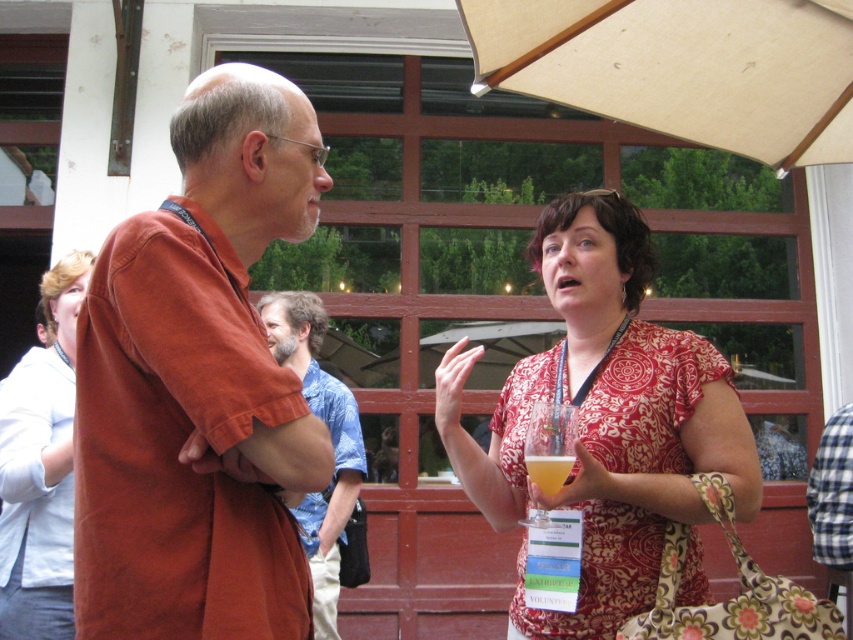
Question: Is patterned fabric dress at center to the left of blue floral shirt at center from the viewer's perspective?

Choices:
 (A) no
 (B) yes

Answer: (A)

Question: Which of the following is the closest to the observer?

Choices:
 (A) (202, 93)
 (B) (541, 42)
 (C) (643, 596)

Answer: (A)

Question: Where is matte orange shirt at center located in relation to translucent plastic cup at center in the image?

Choices:
 (A) below
 (B) above

Answer: (B)

Question: Based on their relative distances, which object is farther from the patterned fabric dress at center?

Choices:
 (A) beige fabric umbrella at upper center
 (B) light blue cotton shirt at left
 (C) blue floral shirt at center

Answer: (C)

Question: Among these points, which one is farthest from the camera?

Choices:
 (A) (675, 72)
 (B) (288, 445)

Answer: (A)

Question: Does matte orange shirt at center appear under light blue cotton shirt at left?

Choices:
 (A) yes
 (B) no

Answer: (B)